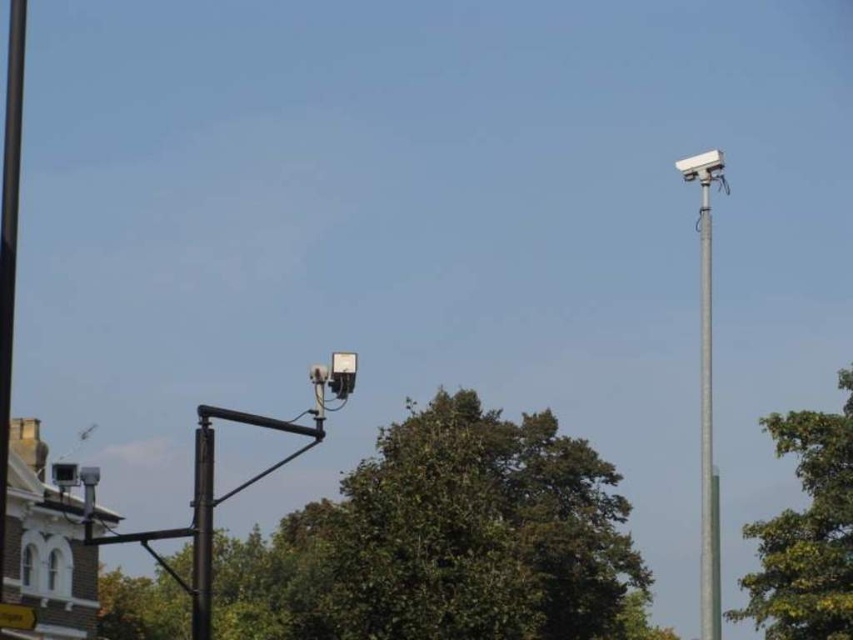
Question: Which object is positioned farthest from the silver metallic pole at upper right?

Choices:
 (A) black metal pole at center
 (B) green leafy tree at right

Answer: (A)

Question: Among these points, which one is farthest from the camera?

Choices:
 (A) (833, 445)
 (B) (714, 602)

Answer: (A)

Question: Is green leafy tree at right smaller than metallic silver street sign at lower left?

Choices:
 (A) yes
 (B) no

Answer: (A)

Question: Does black metal pole at center appear under metallic silver street sign at lower left?

Choices:
 (A) yes
 (B) no

Answer: (B)

Question: Is green leafy tree at center below white plastic security camera at upper right?

Choices:
 (A) no
 (B) yes

Answer: (B)

Question: Among these objects, which one is nearest to the camera?

Choices:
 (A) white plastic security camera at upper right
 (B) green leafy tree at right
 (C) metallic silver street sign at lower left

Answer: (C)